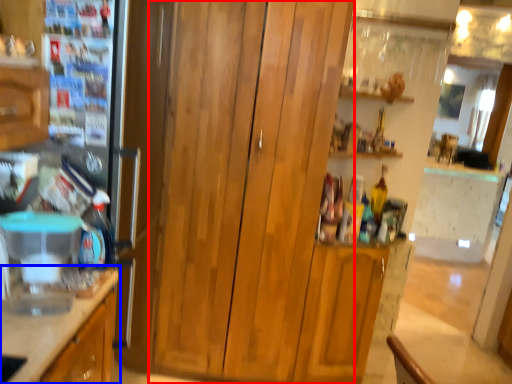
Question: Which point is further to the camera, dresser (highlighted by a red box) or cabinetry (highlighted by a blue box)?

Choices:
 (A) dresser
 (B) cabinetry

Answer: (A)